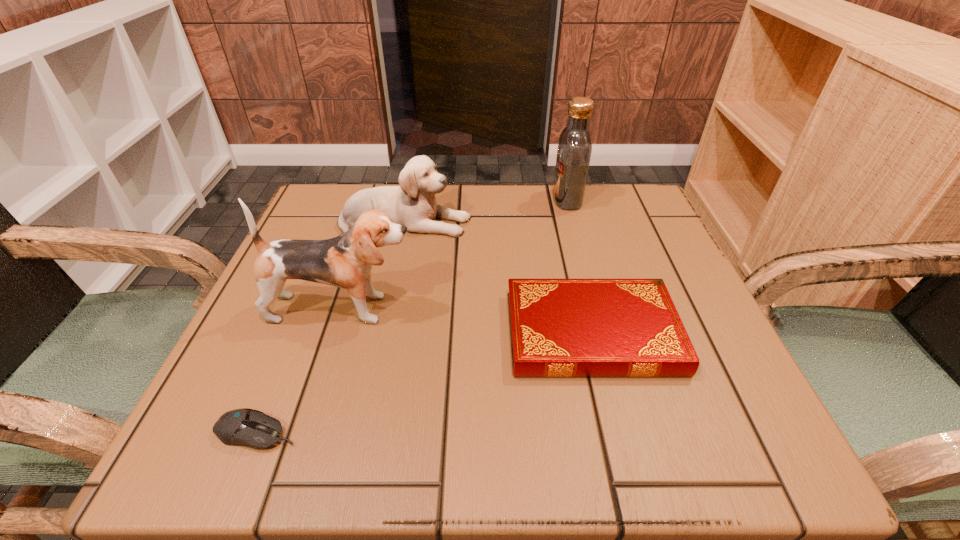
Locate an element on the screen. The image size is (960, 540). vacant space located at the face of the nearer puppy is located at coordinates pos(492,308).

At what (x,y) coordinates should I click in order to perform the action: click on vacant space located on the front-facing side of the shorter puppy. Please return your answer as a coordinate pair (x, y). Image resolution: width=960 pixels, height=540 pixels. Looking at the image, I should click on [x=499, y=222].

The height and width of the screenshot is (540, 960). Find the location of `vacant area situated on the cover of the fourth tallest object`. vacant area situated on the cover of the fourth tallest object is located at coordinates (327, 333).

Where is `vacant space located on the cover of the fourth tallest object`? The image size is (960, 540). vacant space located on the cover of the fourth tallest object is located at coordinates (376, 333).

Where is `vacant region located on the cover of the fourth tallest object`? This screenshot has width=960, height=540. vacant region located on the cover of the fourth tallest object is located at coordinates (309, 333).

Where is `vacant position located 0.200m on the back of the computer mouse`? This screenshot has height=540, width=960. vacant position located 0.200m on the back of the computer mouse is located at coordinates (305, 310).

Locate an element on the screen. vodka situated at the far edge is located at coordinates (574, 151).

I want to click on puppy that is at the far edge, so click(413, 204).

Find the location of `object situated at the near edge`. object situated at the near edge is located at coordinates (246, 427).

The height and width of the screenshot is (540, 960). Find the location of `computer mouse that is positioned at the left edge`. computer mouse that is positioned at the left edge is located at coordinates click(246, 427).